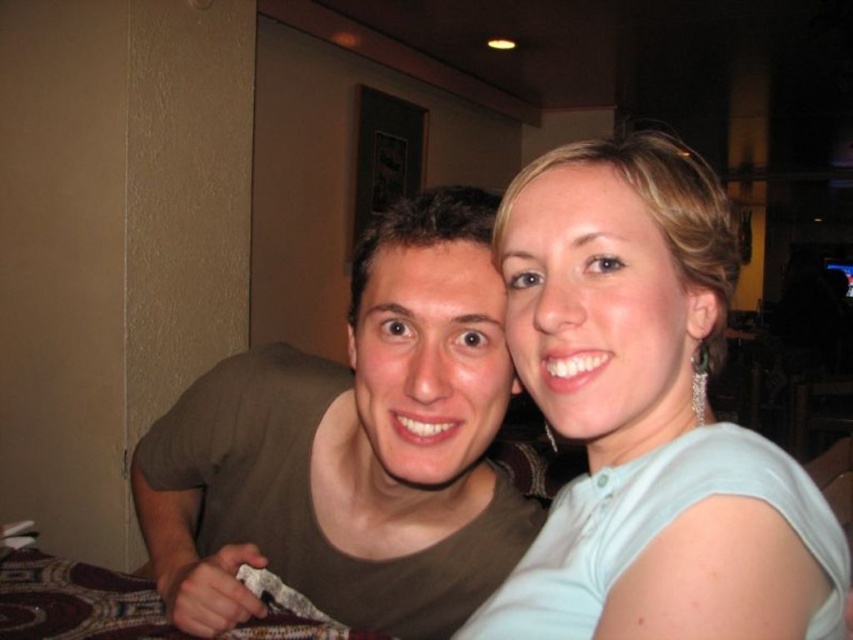
Can you confirm if light blue fabric at upper right is bigger than matte brown shirt at center?

Actually, light blue fabric at upper right might be smaller than matte brown shirt at center.

The width and height of the screenshot is (853, 640). Describe the element at coordinates (646, 416) in the screenshot. I see `light blue fabric at upper right` at that location.

Image resolution: width=853 pixels, height=640 pixels. Find the location of `light blue fabric at upper right`. light blue fabric at upper right is located at coordinates (646, 416).